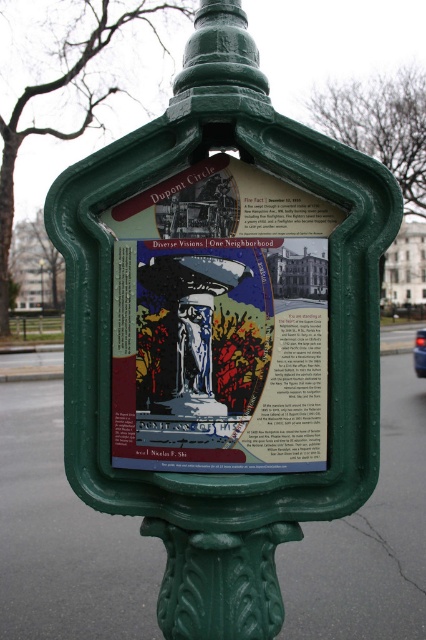
You are a pedestrian walking towards the green plastic sign at center and the matte paper poster at center. Which object will you encounter first?

The matte paper poster at center is in front of the green plastic sign at center, so you will encounter the matte paper poster at center first.

You are a photographer trying to capture the street signpost and its plaque. You notice two points marked on your viewfinder at coordinates point (241, 339) and point (40, 269). Which point is positioned closer to your camera lens?

Point (241, 339) is closer to the camera than point (40, 269).

You are a pedestrian passing by the signpost and want to read both the matte paper poster at center and the green plastic sign at center. Which one should you look at first to read them in the correct order?

You should look at the green plastic sign at center first because the matte paper poster at center is positioned on the right side of it, so reading from left to right would start with the green plastic sign at center.